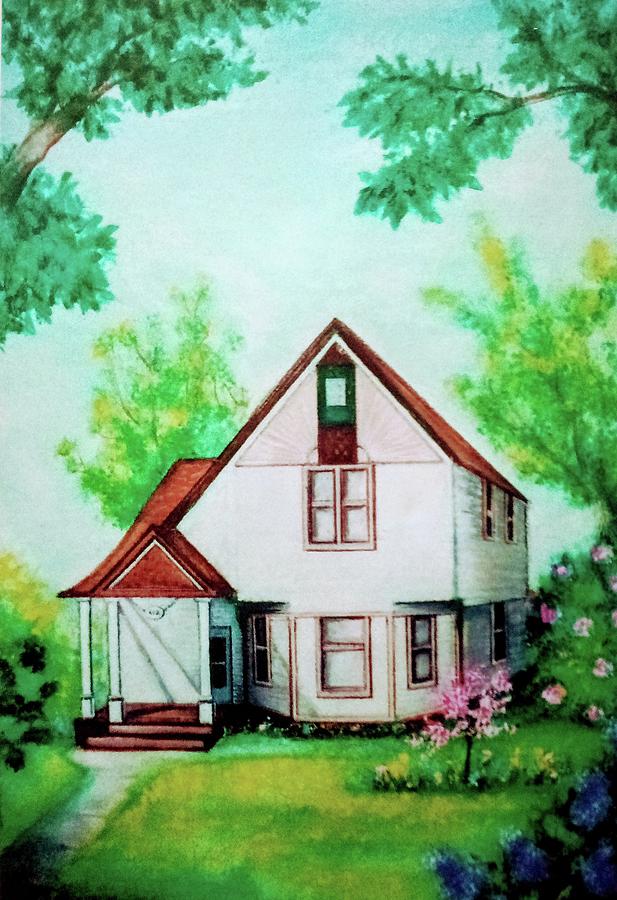
Image resolution: width=617 pixels, height=900 pixels. Find the location of `painting`. painting is located at coordinates (261, 343).